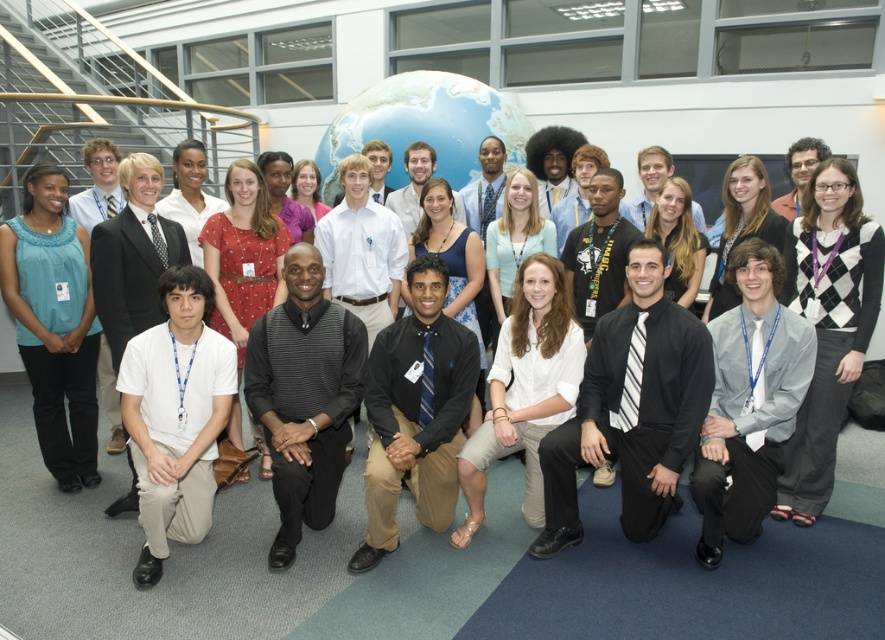
Does black striped sweater at center appear over matte blue blouse at left?

No.

The image size is (885, 640). In order to click on black striped sweater at center in this screenshot , I will do `click(304, 396)`.

Locate an element on the screen. The width and height of the screenshot is (885, 640). black striped sweater at center is located at coordinates (304, 396).

Identify the location of black striped sweater at center. This screenshot has height=640, width=885. (304, 396).

Is gray dress shirt at lower right shorter than white cotton shirt at lower left?

In fact, gray dress shirt at lower right may be taller than white cotton shirt at lower left.

Identify the location of gray dress shirt at lower right. The image size is (885, 640). (748, 403).

Which is above, black striped sweater at center or white matte shirt at center?

Positioned higher is black striped sweater at center.

Who is more distant from viewer, (297, 433) or (483, 458)?

Point (483, 458)

Identify the location of black striped sweater at center. The width and height of the screenshot is (885, 640). (304, 396).